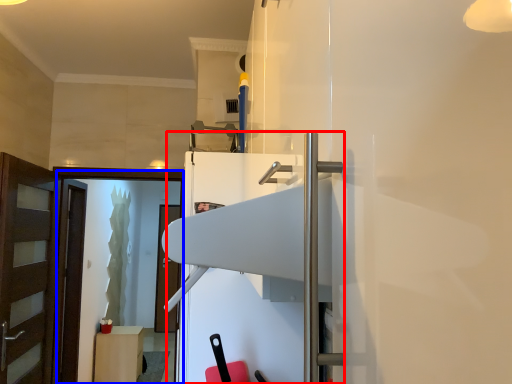
Question: Which object is closer to the camera taking this photo, fridge (highlighted by a red box) or screen door (highlighted by a blue box)?

Choices:
 (A) fridge
 (B) screen door

Answer: (A)